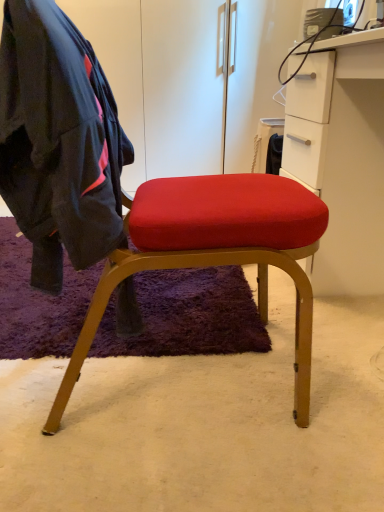
Question: Is white matte cabinet at right placed right next to dark blue fabric jacket at left?

Choices:
 (A) yes
 (B) no

Answer: (B)

Question: From a real-world perspective, is white matte cabinet at right below dark blue fabric jacket at left?

Choices:
 (A) no
 (B) yes

Answer: (B)

Question: Can you confirm if white matte cabinet at right is wider than dark blue fabric jacket at left?

Choices:
 (A) yes
 (B) no

Answer: (A)

Question: Does white matte cabinet at right appear on the left side of dark blue fabric jacket at left?

Choices:
 (A) yes
 (B) no

Answer: (B)

Question: Would you say white matte cabinet at right is a long distance from dark blue fabric jacket at left?

Choices:
 (A) yes
 (B) no

Answer: (B)

Question: Does white matte cabinet at right have a lesser width compared to dark blue fabric jacket at left?

Choices:
 (A) yes
 (B) no

Answer: (B)

Question: From the image's perspective, is dark blue fabric jacket at left beneath white matte cabinet at right?

Choices:
 (A) yes
 (B) no

Answer: (A)

Question: Does dark blue fabric jacket at left have a greater height compared to white matte cabinet at right?

Choices:
 (A) yes
 (B) no

Answer: (B)

Question: Is dark blue fabric jacket at left looking in the opposite direction of white matte cabinet at right?

Choices:
 (A) no
 (B) yes

Answer: (A)

Question: Can you confirm if dark blue fabric jacket at left is positioned to the right of white matte cabinet at right?

Choices:
 (A) yes
 (B) no

Answer: (B)

Question: Considering the relative sizes of dark blue fabric jacket at left and white matte cabinet at right in the image provided, is dark blue fabric jacket at left wider than white matte cabinet at right?

Choices:
 (A) no
 (B) yes

Answer: (A)

Question: Considering the relative sizes of dark blue fabric jacket at left and white matte cabinet at right in the image provided, is dark blue fabric jacket at left bigger than white matte cabinet at right?

Choices:
 (A) no
 (B) yes

Answer: (A)

Question: Looking at the image, does dark blue fabric jacket at left seem bigger or smaller compared to white matte cabinet at right?

Choices:
 (A) big
 (B) small

Answer: (B)